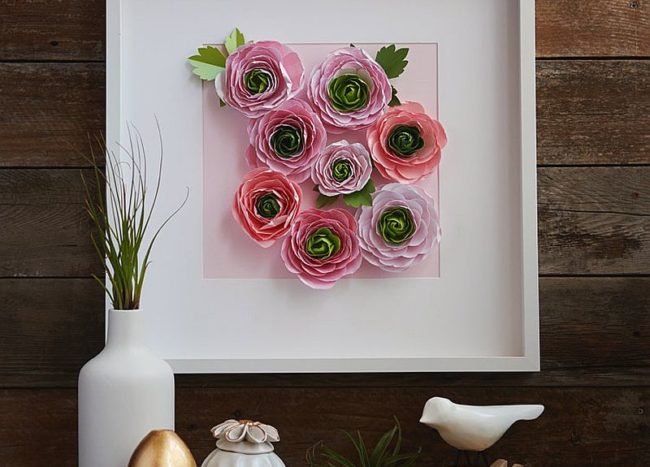
Where is `bird sculpture`? The height and width of the screenshot is (467, 650). bird sculpture is located at coordinates (468, 430).